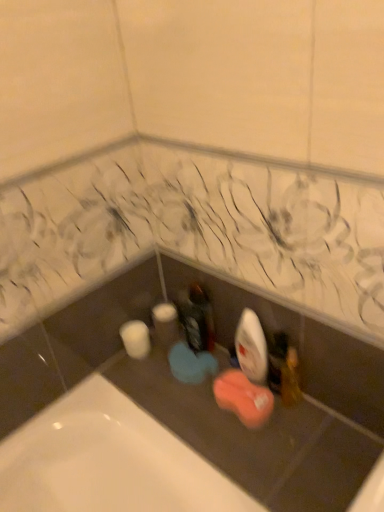
Question: Considering the relative positions of matte black bottle at center and wooden toothbrush at lower right in the image provided, is matte black bottle at center to the left or to the right of wooden toothbrush at lower right?

Choices:
 (A) left
 (B) right

Answer: (A)

Question: Choose the correct answer: Is matte black bottle at center inside wooden toothbrush at lower right or outside it?

Choices:
 (A) inside
 (B) outside

Answer: (B)

Question: Estimate the real-world distances between objects in this image. Which object is farther from the matte black bottle at center?

Choices:
 (A) white matte toilet paper at lower left
 (B) wooden toothbrush at lower right

Answer: (B)

Question: Which is nearer to the wooden toothbrush at lower right?

Choices:
 (A) white matte toilet paper at lower left
 (B) matte black bottle at center

Answer: (B)